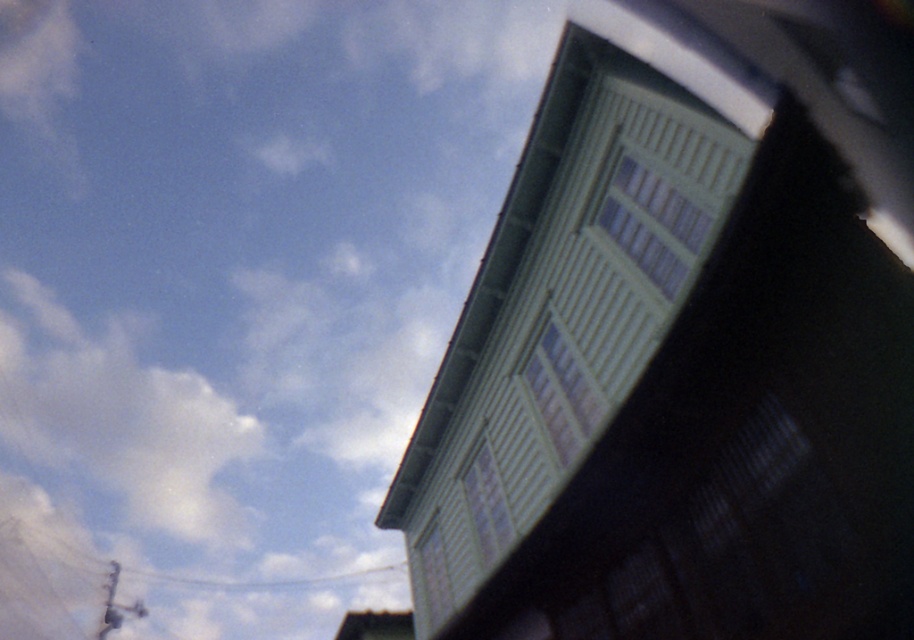
Which of these two, green matte window at upper right or white fluffy cloud at upper left, stands taller?

Standing taller between the two is white fluffy cloud at upper left.

Can you confirm if green matte window at upper right is thinner than white fluffy cloud at upper left?

Indeed, green matte window at upper right has a lesser width compared to white fluffy cloud at upper left.

Where is `green matte window at upper right`? Image resolution: width=914 pixels, height=640 pixels. green matte window at upper right is located at coordinates (667, 388).

Who is more distant from viewer, (28, 387) or (379, 572)?

Positioned behind is point (28, 387).

Based on the photo, which is above, white fluffy cloud at upper left or metallic wire at upper center?

white fluffy cloud at upper left is higher up.

This screenshot has width=914, height=640. What do you see at coordinates (117, 417) in the screenshot?
I see `white fluffy cloud at upper left` at bounding box center [117, 417].

At what (x,y) coordinates should I click in order to perform the action: click on white fluffy cloud at upper left. Please return your answer as a coordinate pair (x, y). This screenshot has height=640, width=914. Looking at the image, I should click on (117, 417).

Who is more distant from viewer, (675, 480) or (298, 586)?

The point (298, 586) is behind.

Based on the photo, is green matte window at upper right below metallic wire at upper center?

No.

Find the location of `green matte window at upper right`. green matte window at upper right is located at coordinates (667, 388).